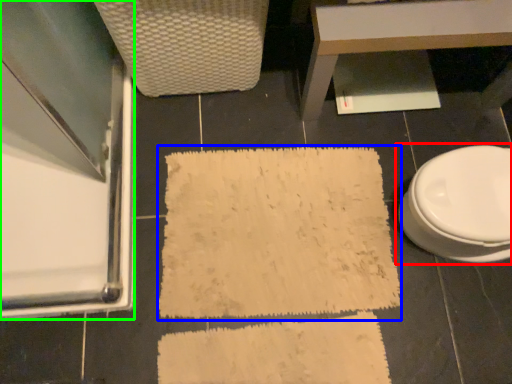
Question: Estimate the real-world distances between objects in this image. Which object is closer to toilet (highlighted by a red box), bath mat (highlighted by a blue box) or screen door (highlighted by a green box)?

Choices:
 (A) bath mat
 (B) screen door

Answer: (A)